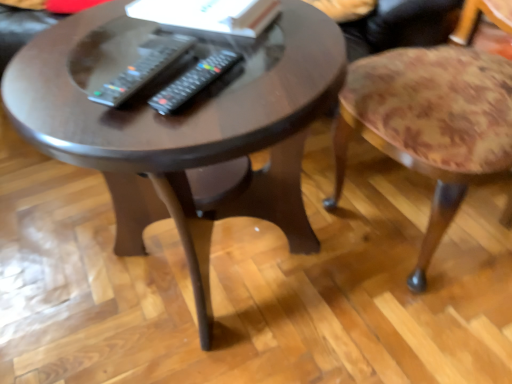
Question: Looking at their shapes, would you say black plastic remote at center, acting as the 1th remote starting from the right, is wider or thinner than dark wood coffee table at center?

Choices:
 (A) thin
 (B) wide

Answer: (A)

Question: Is black plastic remote at center, acting as the 1th remote starting from the right, taller or shorter than dark wood coffee table at center?

Choices:
 (A) tall
 (B) short

Answer: (B)

Question: Considering the real-world distances, which object is farthest from the floral fabric stool at right?

Choices:
 (A) black plastic remote at center, acting as the 1th remote starting from the right
 (B) black plastic remote at center, which appears as the 1th remote when viewed from the left
 (C) dark wood coffee table at center

Answer: (B)

Question: Which is farther from the dark wood coffee table at center?

Choices:
 (A) black plastic remote at center, acting as the 1th remote starting from the right
 (B) black plastic remote at center, which ranks as the second remote in right-to-left order
 (C) floral fabric stool at right

Answer: (C)